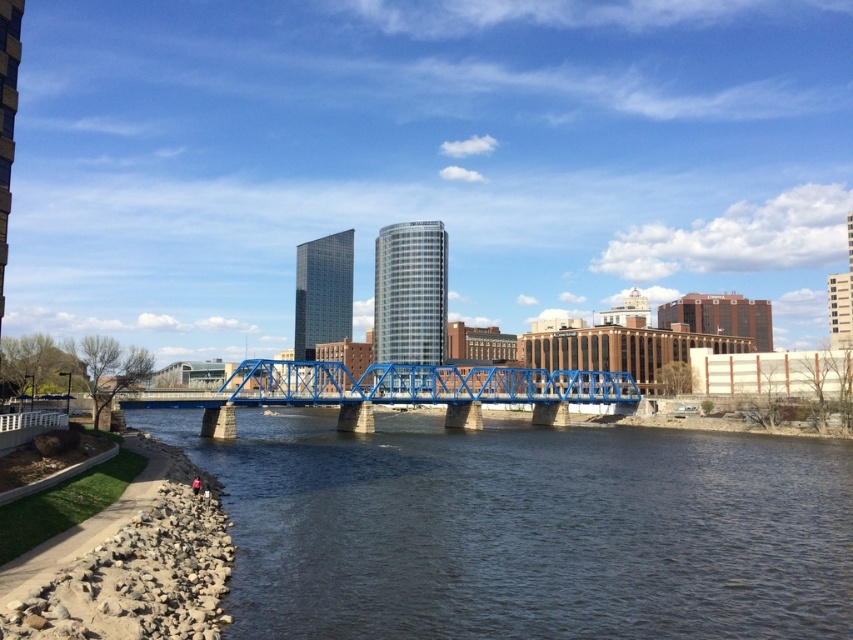
Question: Does dark blue water at lower center have a smaller size compared to blue metallic bridge at center?

Choices:
 (A) no
 (B) yes

Answer: (B)

Question: Which point is closer to the camera?

Choices:
 (A) (247, 440)
 (B) (461, 422)

Answer: (A)

Question: In this image, where is dark blue water at lower center located relative to blue metallic bridge at center?

Choices:
 (A) right
 (B) left

Answer: (B)

Question: Is dark blue water at lower center bigger than blue metallic bridge at center?

Choices:
 (A) yes
 (B) no

Answer: (B)